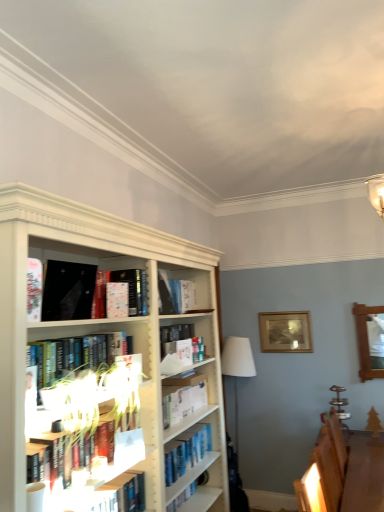
Question: Which is correct: wooden table at lower right is inside white fabric lampshade at center, or outside of it?

Choices:
 (A) outside
 (B) inside

Answer: (A)

Question: Is wooden table at lower right wider or thinner than white fabric lampshade at center?

Choices:
 (A) thin
 (B) wide

Answer: (B)

Question: Which object is the farthest from the matte white paperback book at center, acting as the first paperback book starting from the back?

Choices:
 (A) wooden table at lower right
 (B) wooden picture frame at upper center
 (C) hardcover book at center, arranged as the 1th book when ordered from the bottom
 (D) white matte bookshelf at left, which appears as the 2th book when ordered from the bottom
 (E) hardcover book at center, which is the first book in top-to-bottom order

Answer: (B)

Question: Estimate the real-world distances between objects in this image. Which object is farther from the white fabric lampshade at center?

Choices:
 (A) hardcover book at center, the 3th book ordered from the bottom
 (B) wooden picture frame at upper center
 (C) hardcover book at center, which is the 3th book from top to bottom
 (D) white matte bookshelf at left, arranged as the second book when viewed from the top
 (E) matte white paperback book at center, acting as the first paperback book starting from the back

Answer: (D)